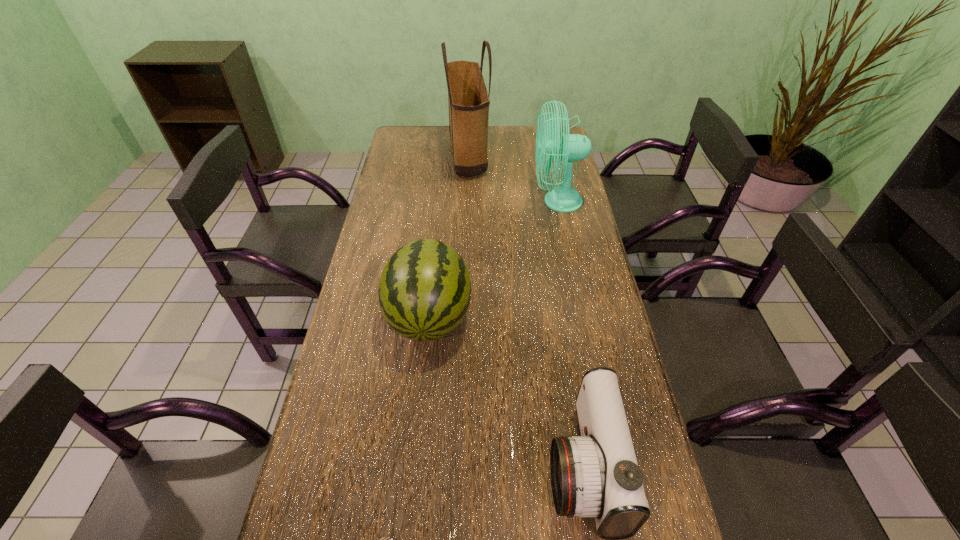
The image size is (960, 540). I want to click on object that is at the left edge, so click(x=424, y=293).

This screenshot has width=960, height=540. I want to click on object that is at the right edge, so click(x=568, y=147).

In the image, there is a desktop. At what (x,y) coordinates should I click in order to perform the action: click on free space at the left edge. Please return your answer as a coordinate pair (x, y). Looking at the image, I should click on point(336,452).

Locate an element on the screen. This screenshot has height=540, width=960. free space at the right edge of the desktop is located at coordinates (582, 222).

Identify the location of free space at the far left corner of the desktop. (433, 133).

You are a GUI agent. You are given a task and a screenshot of the screen. Output one action in this format:
    pyautogui.click(x=<x>, y=<y>)
    Task: Click on the vacant space at the far right corner of the desktop
    This screenshot has width=960, height=540.
    Given the screenshot: What is the action you would take?
    pyautogui.click(x=532, y=130)

Image resolution: width=960 pixels, height=540 pixels. I want to click on vacant region between the watermelon and the tote bag, so click(448, 237).

Identify which object is the nearest to the fourth tallest object. Please provide its 2D coordinates. Your answer should be formatted as a tuple, i.e. [(x, y)], where the tuple contains the x and y coordinates of a point satisfying the conditions above.

[(424, 293)]

Locate an element on the screen. object that ranks as the closest to the second tallest object is located at coordinates tap(468, 99).

The width and height of the screenshot is (960, 540). In order to click on vacant point that satisfies the following two spatial constraints: 1. in front of the second tallest object to blow air; 2. at the stem end of the third shortest object in this screenshot , I will do `click(581, 316)`.